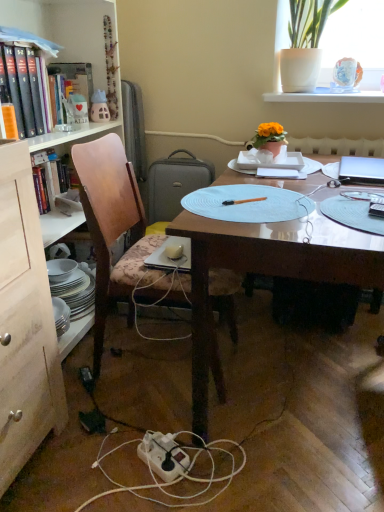
At what (x,y) coordinates should I click in order to perform the action: click on vacant space situated on the left part of white plastic power outlet at lower center. Please return your answer as a coordinate pair (x, y). The width and height of the screenshot is (384, 512). Looking at the image, I should click on (106, 462).